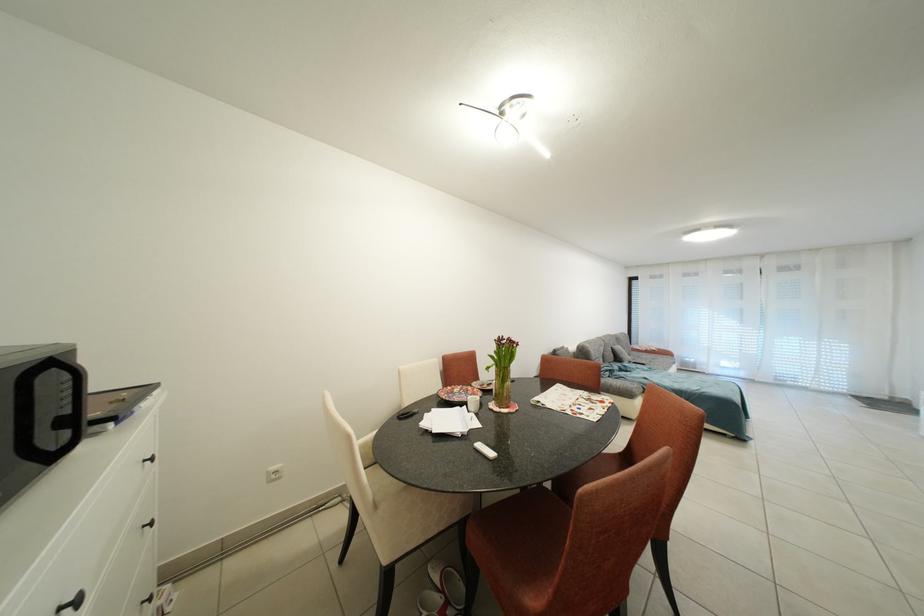
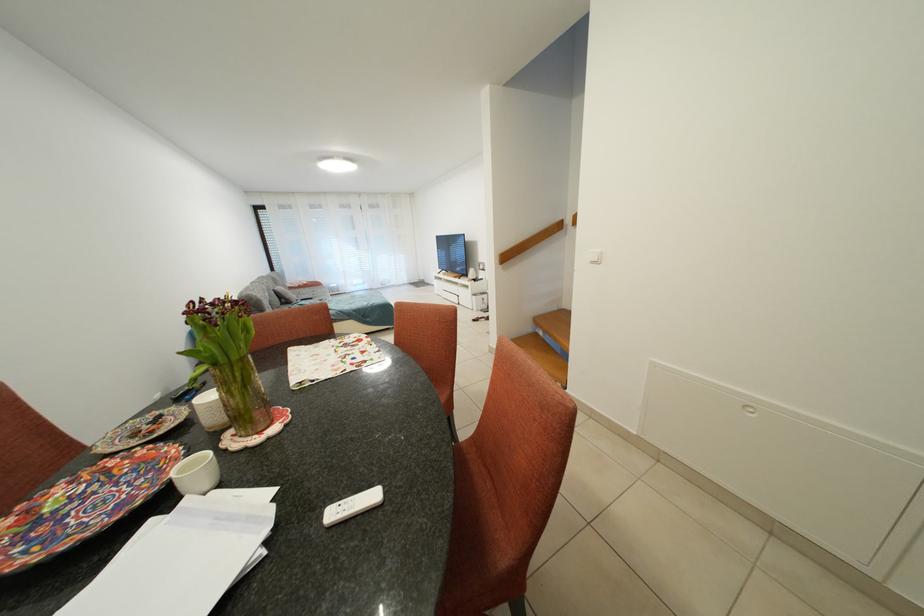
The first image is from the beginning of the video and the second image is from the end. How did the camera likely rotate when shooting the video?

The camera rotated toward right-down.